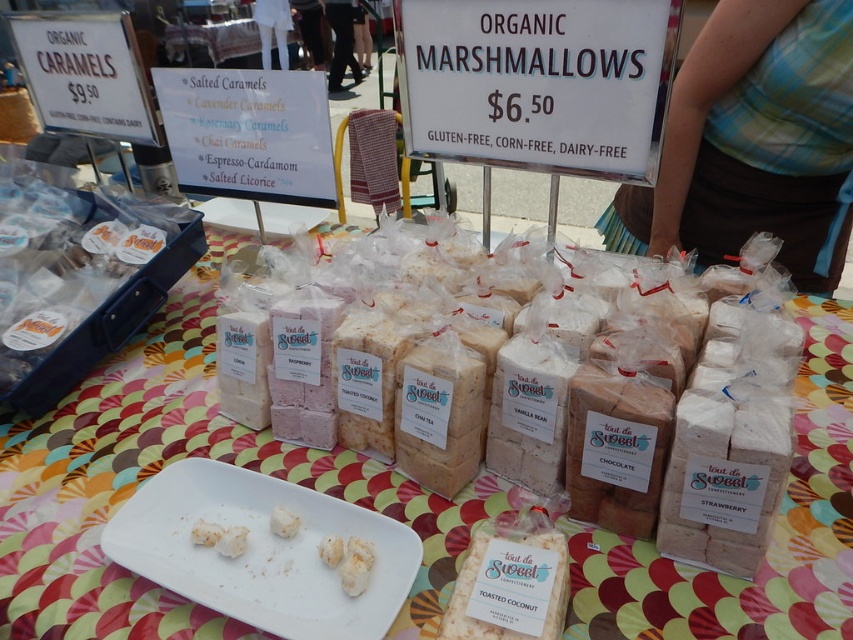
Question: Which of the following is the farthest from the observer?

Choices:
 (A) (614, 90)
 (B) (22, 214)

Answer: (B)

Question: Is polka dot fabric at center bigger than matte white chocolate at left?

Choices:
 (A) yes
 (B) no

Answer: (A)

Question: Which object is the closest to the matte white chocolate at left?

Choices:
 (A) white paper sign at upper left
 (B) white fluffy marshmallow at center

Answer: (A)

Question: Can you confirm if white paper sign at upper center is thinner than white paper sign at upper left?

Choices:
 (A) yes
 (B) no

Answer: (B)

Question: Which of the following is the closest to the observer?

Choices:
 (A) polka dot fabric at center
 (B) white paper sign at upper left

Answer: (A)

Question: Is white paper sign at upper center above matte white chocolate at left?

Choices:
 (A) yes
 (B) no

Answer: (A)